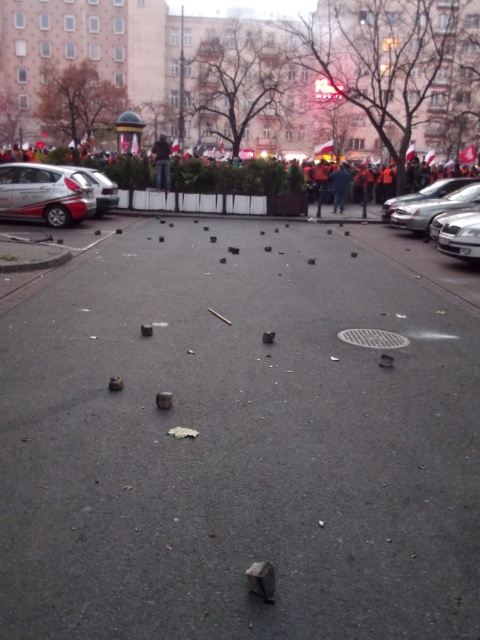
How much distance is there between silver metallic hatchback at left and silver metallic car at left?

silver metallic hatchback at left and silver metallic car at left are 28.06 inches apart.

Between point (45, 179) and point (83, 170), which one is positioned in front?

Point (45, 179) is more forward.

This screenshot has height=640, width=480. What do you see at coordinates (45, 193) in the screenshot? I see `silver metallic hatchback at left` at bounding box center [45, 193].

The image size is (480, 640). Identify the location of silver metallic hatchback at left. (45, 193).

Is dark gray jacket at center to the right of dark blue jacket at center from the viewer's perspective?

Incorrect, dark gray jacket at center is not on the right side of dark blue jacket at center.

What do you see at coordinates (162, 163) in the screenshot?
I see `dark gray jacket at center` at bounding box center [162, 163].

I want to click on dark gray jacket at center, so click(x=162, y=163).

How distant is metallic silver car at right from dark gray jacket at center?

metallic silver car at right and dark gray jacket at center are 5.62 meters apart from each other.

Can you confirm if metallic silver car at right is bigger than dark gray jacket at center?

Actually, metallic silver car at right might be smaller than dark gray jacket at center.

What are the coordinates of `metallic silver car at right` in the screenshot? It's located at (433, 209).